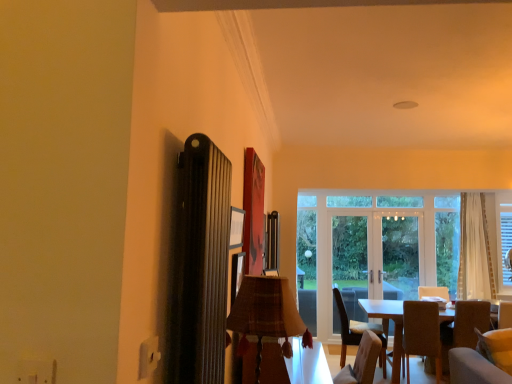
Question: In terms of size, does dark wood table at lower right, the second table from the left, appear bigger or smaller than transparent glass window at center?

Choices:
 (A) small
 (B) big

Answer: (B)

Question: From their relative heights in the image, would you say dark wood table at lower right, the second table from the left, is taller or shorter than transparent glass window at center?

Choices:
 (A) tall
 (B) short

Answer: (B)

Question: Estimate the real-world distances between objects in this image. Which object is closer to the brown fabric chair at lower right, which is the first chair in right-to-left order?

Choices:
 (A) velvet beige couch at lower right
 (B) soft beige fabric armchair at lower right
 (C) clear glass door at center, which is counted as the 1th screen door, starting from the left
 (D) brown fabric chair at lower right, which is counted as the second chair, starting from the right
 (E) white sheer curtain at right

Answer: (B)

Question: Which of these objects is positioned farthest from the clear glass door at center, the 2th screen door viewed from the left?

Choices:
 (A) transparent glass window at center
 (B) plaid fabric lampshade at center
 (C) velvet beige couch at lower right
 (D) white sheer curtain at right
 (E) soft beige fabric armchair at lower right

Answer: (B)